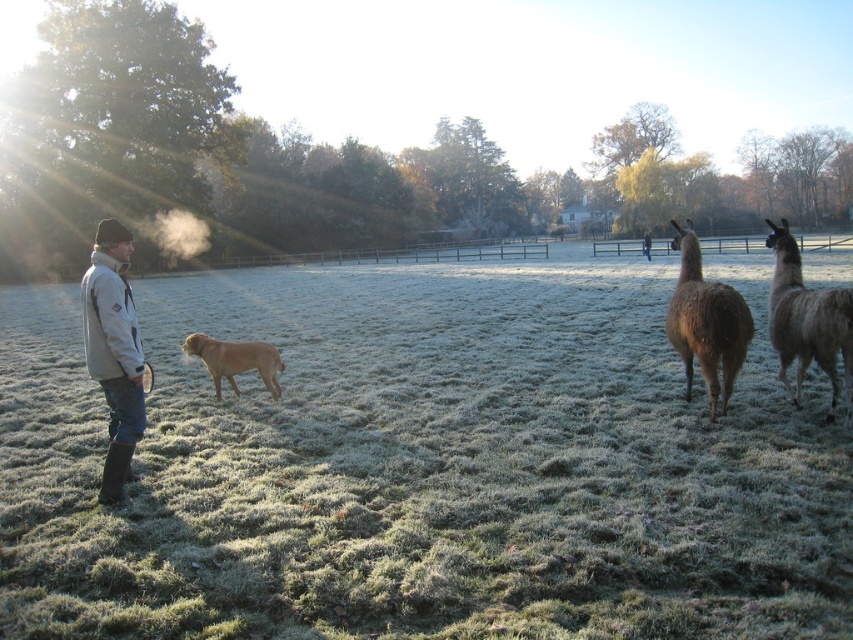
In the scene shown: Who is more distant from viewer, (84, 353) or (845, 289)?

The point (84, 353) is more distant.

Who is lower down, light gray jacket at left or gray woolen alpaca at right?

light gray jacket at left is lower down.

Is point (125, 308) positioned after point (798, 285)?

No, (125, 308) is closer to viewer.

Find the location of a particular element. The height and width of the screenshot is (640, 853). light gray jacket at left is located at coordinates (113, 349).

Is light gray jacket at left further to camera compared to light gray jacket at center?

No, light gray jacket at left is closer to the viewer.

Does light gray jacket at left appear on the left side of light gray jacket at center?

→ Indeed, light gray jacket at left is positioned on the left side of light gray jacket at center.

This screenshot has height=640, width=853. I want to click on light gray jacket at left, so click(x=113, y=349).

Can you confirm if brown woolly alpaca at right is shorter than light gray jacket at center?

In fact, brown woolly alpaca at right may be taller than light gray jacket at center.

Who is more forward, (x=683, y=246) or (x=648, y=257)?

Point (x=683, y=246)

What do you see at coordinates (706, 323) in the screenshot?
I see `brown woolly alpaca at right` at bounding box center [706, 323].

Find the location of a particular element. This screenshot has height=640, width=853. brown woolly alpaca at right is located at coordinates point(706,323).